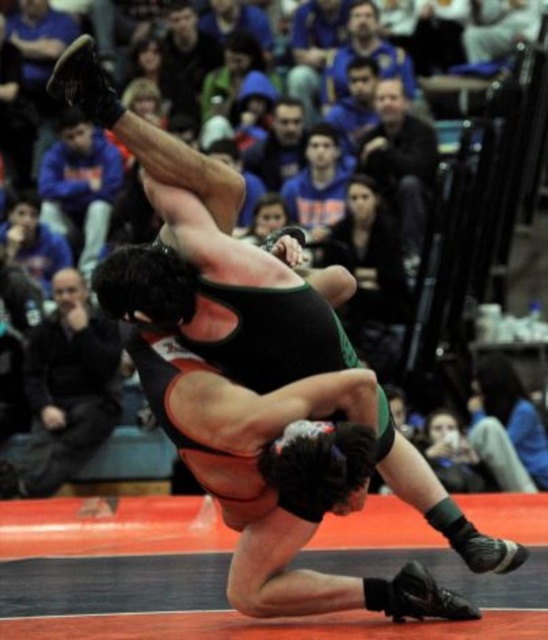
Question: Is blue fleece jacket at upper center bigger than dark blue jacket at upper center?

Choices:
 (A) yes
 (B) no

Answer: (B)

Question: Which object is the farthest from the black fabric referee at left?

Choices:
 (A) dark blue jacket at upper center
 (B) blue fleece jacket at upper center

Answer: (A)

Question: Estimate the real-world distances between objects in this image. Which object is farther from the black fabric referee at left?

Choices:
 (A) dark blue jacket at upper center
 (B) blue fleece jacket at upper center

Answer: (A)

Question: Which point appears closest to the camera in this image?

Choices:
 (A) (45, 481)
 (B) (82, 192)
 (C) (427, 163)

Answer: (A)

Question: Is the position of black fabric referee at left more distant than that of dark blue jacket at upper center?

Choices:
 (A) no
 (B) yes

Answer: (A)

Question: From the image, what is the correct spatial relationship of black fabric referee at left in relation to dark blue jacket at upper center?

Choices:
 (A) right
 (B) left

Answer: (B)